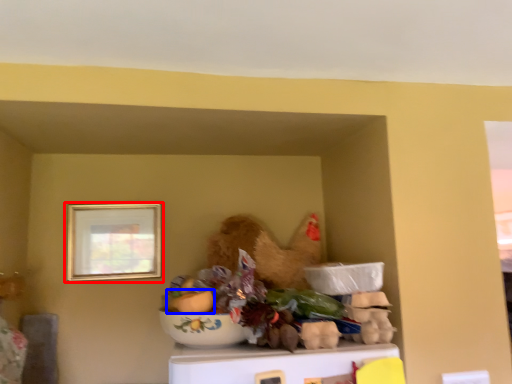
Question: Which point is closer to the camera, picture frame (highlighted by a red box) or food (highlighted by a blue box)?

Choices:
 (A) picture frame
 (B) food

Answer: (B)